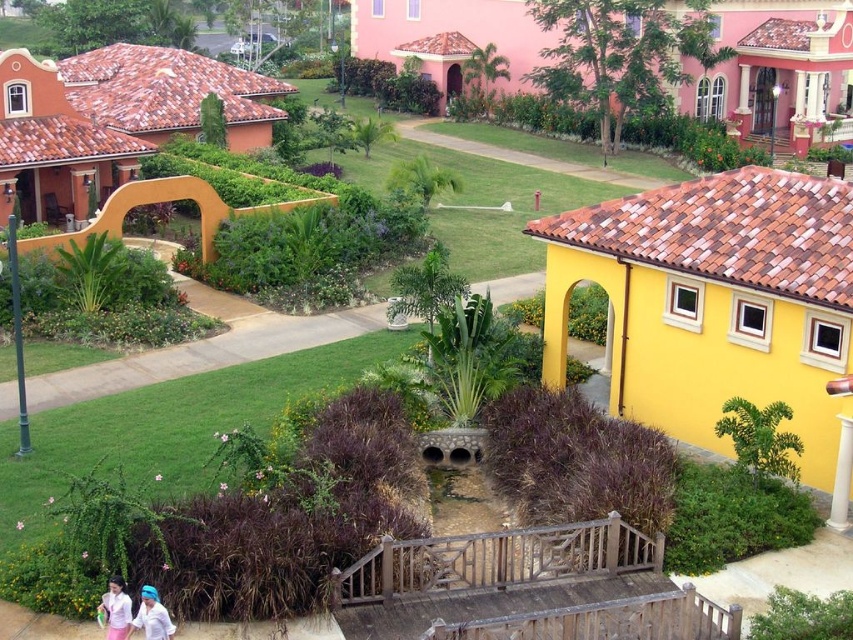
In the scene shown: You are a photographer setting up a shoot in the resort area. You have two outfits to choose from for the photoshoot. The outfits are the pink fabric dress at lower left and the white matte shirt at lower left. Which outfit would you recommend to ensure it doesn not overwhelm the tropical garden background?

The pink fabric dress at lower left has a lesser width compared to the white matte shirt at lower left. Therefore, the pink fabric dress at lower left would be less likely to overwhelm the tropical garden background due to its narrower design.

You are a photographer standing at the center of the resort. You want to capture both the pink fabric dress at lower left and the white matte shirt at lower left in the same frame without moving the subjects. Can you fit both in your camera frame that has a maximum width of 18 inches?

The distance between the pink fabric dress at lower left and the white matte shirt at lower left is 16.53 inches. Since the camera frame can accommodate up to 18 inches, both items can be captured in the same frame without moving them.

You are a guest at the resort and you see the pink fabric dress at lower left and the white matte shirt at lower left. Which one is closer to the ground?

The pink fabric dress at lower left is below the white matte shirt at lower left, so it is closer to the ground.